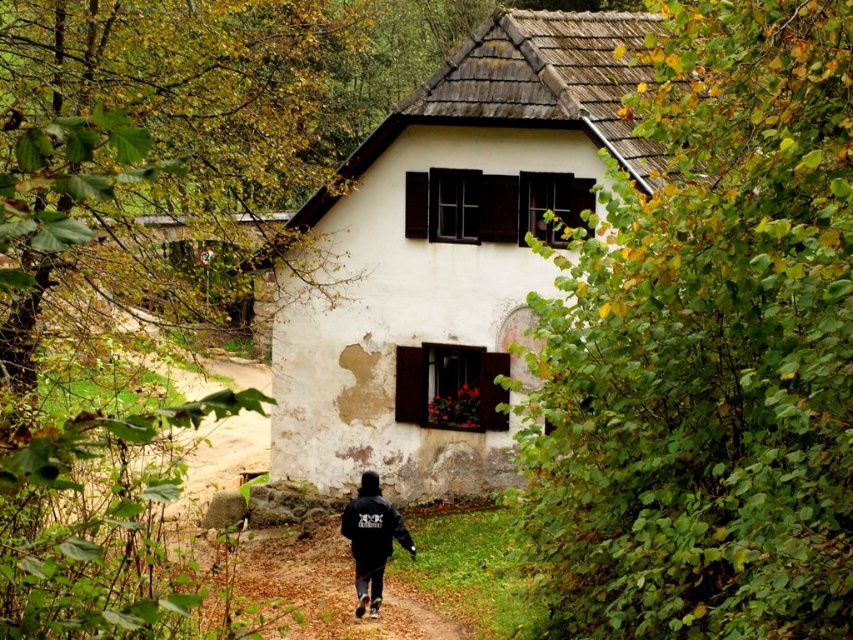
You are standing in front of the rustic house and want to place a small garden ornament between the two points marked as point (370,612) and point (386,525). Which point is closer to you so you can start placing the ornament there?

Point (370,612) is further to the viewer than point (386,525), so the closer point to you is point (386,525). You should start placing the ornament there.